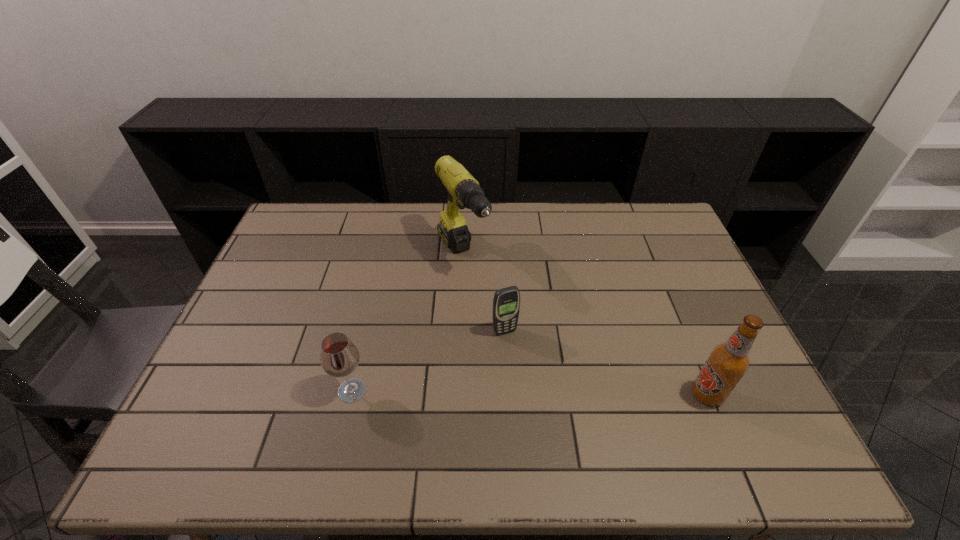
You are a GUI agent. You are given a task and a screenshot of the screen. Output one action in this format:
    pyautogui.click(x=<x>, y=<y>)
    Task: Click on the vacant space on the desktop that is between the leftmost object and the rightmost object and is positioned on the handle side of the farthest object
    
    Given the screenshot: What is the action you would take?
    pyautogui.click(x=560, y=393)

Image resolution: width=960 pixels, height=540 pixels. Identify the location of vacant spot on the desktop that is between the leftmost object and the beer bottle and is positioned on the screen of the second farthest object. (537, 393).